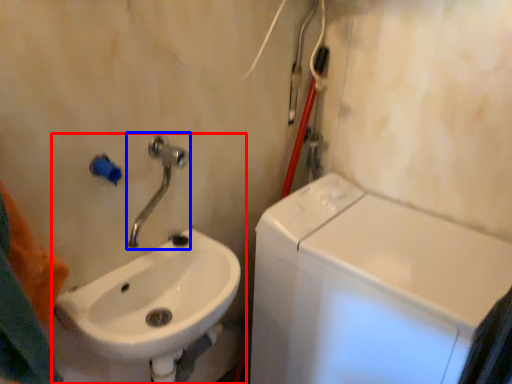
Question: Which of the following is the farthest to the observer, sink (highlighted by a red box) or tap (highlighted by a blue box)?

Choices:
 (A) sink
 (B) tap

Answer: (B)